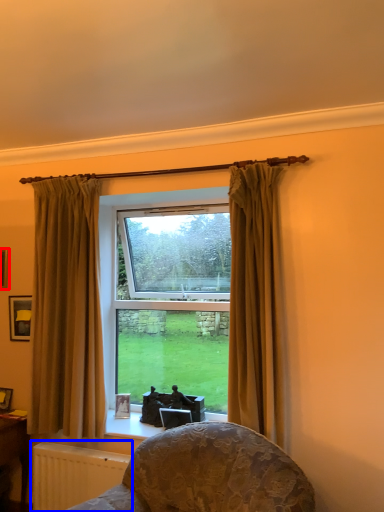
Question: Which point is closer to the camera, picture frame (highlighted by a red box) or radiator (highlighted by a blue box)?

Choices:
 (A) picture frame
 (B) radiator

Answer: (B)